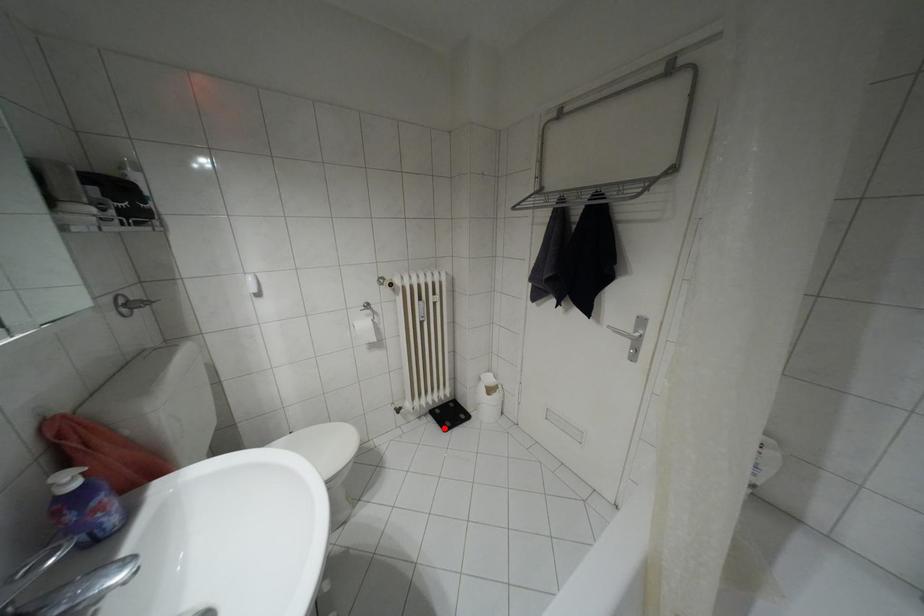
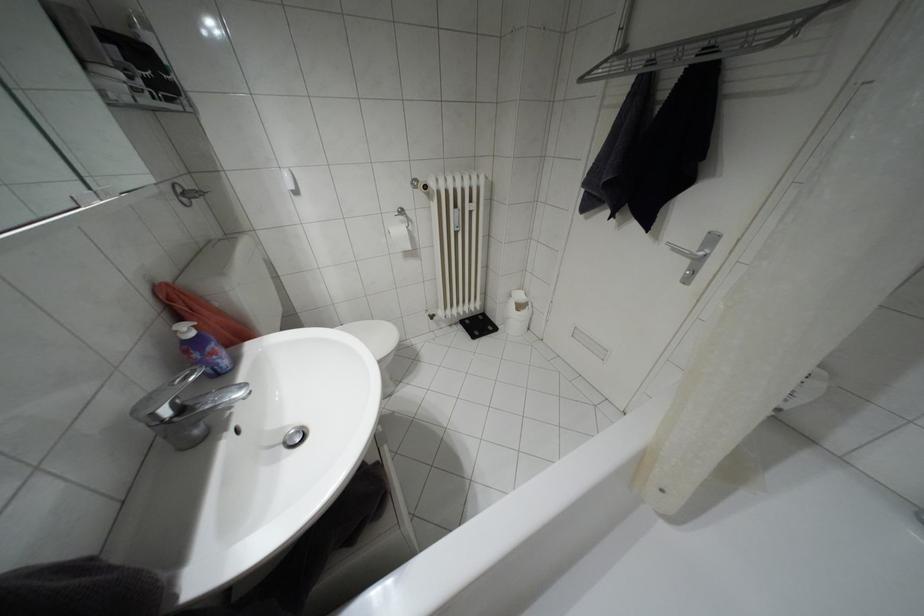
Where in the second image is the point corresponding to the highlighted location from the first image?

(472, 336)